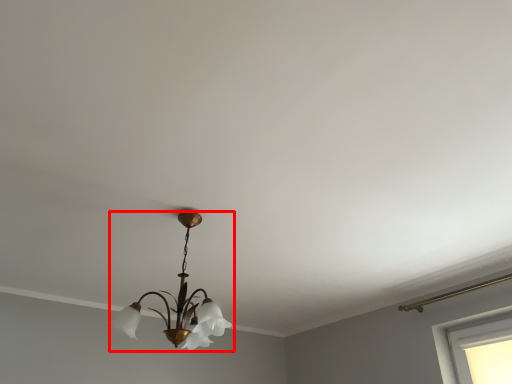
Question: From the image's perspective, what is the correct spatial positioning of lamp (annotated by the red box) in reference to window?

Choices:
 (A) above
 (B) below

Answer: (A)